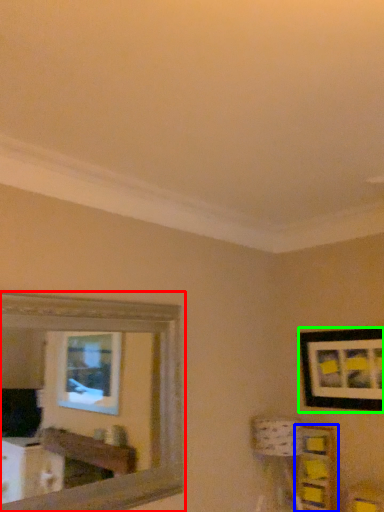
Question: Estimate the real-world distances between objects in this image. Which object is closer to mirror (highlighted by a red box), shelf (highlighted by a blue box) or picture frame (highlighted by a green box)?

Choices:
 (A) shelf
 (B) picture frame

Answer: (A)